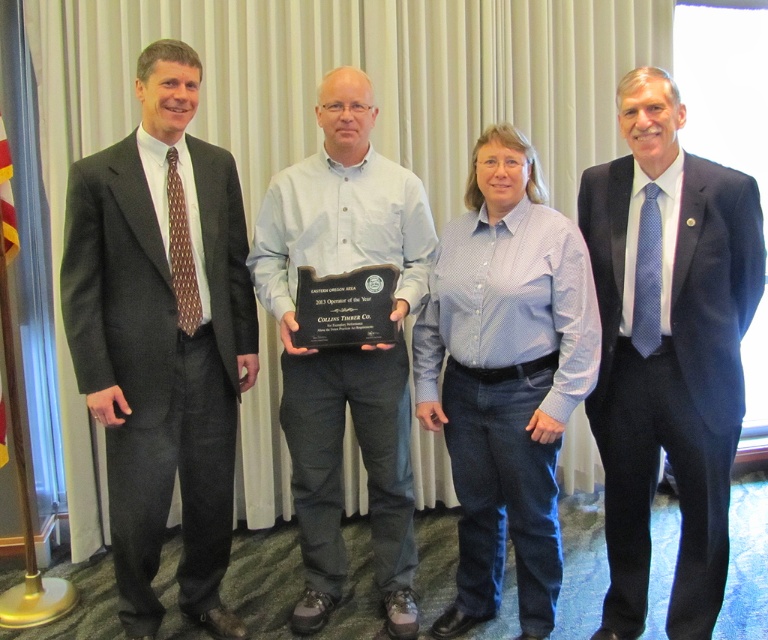
You are standing in the conference room and need to locate the person wearing the dark blue suit at right. According to the coordinates provided, where exactly would you find this individual?

The dark blue suit at right is located at coordinates point 0.545 on the x axis and 0.870 on the y axis.

You are standing in the room and want to hand a document to the person in the dark blue suit at right without walking past the blue cotton shirt at center. Is this possible given their positions?

The dark blue suit at right is closer to the viewer than the blue cotton shirt at center, so yes, you can hand the document to the dark blue suit at right without needing to walk past the blue cotton shirt at center.